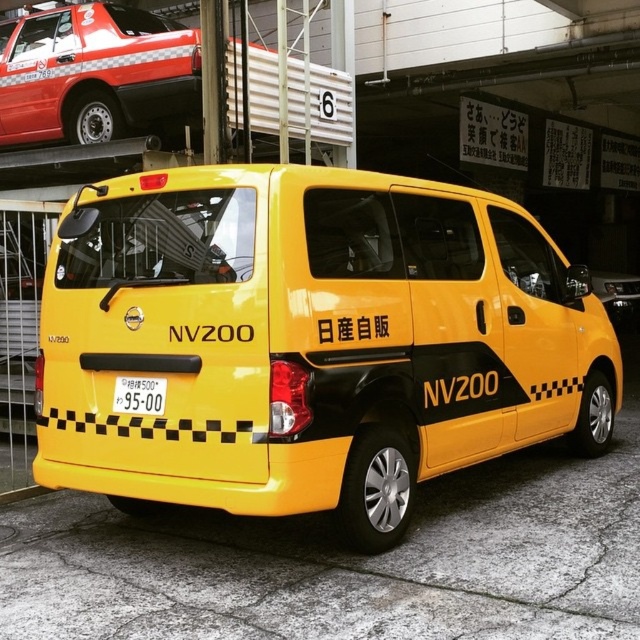
Who is more distant from viewer, (524,358) or (147,392)?

Positioned behind is point (524,358).

Does yellow matte van at center appear under yellow matte license plate at center?

Incorrect, yellow matte van at center is not positioned below yellow matte license plate at center.

What are the coordinates of `yellow matte van at center` in the screenshot? It's located at (308, 340).

Where is `yellow matte van at center`? Image resolution: width=640 pixels, height=640 pixels. yellow matte van at center is located at coordinates (308, 340).

Can you confirm if yellow matte van at center is wider than matte black taxi at upper left?

Correct, the width of yellow matte van at center exceeds that of matte black taxi at upper left.

Is yellow matte van at center above matte black taxi at upper left?

Actually, yellow matte van at center is below matte black taxi at upper left.

Where is `yellow matte van at center`? Image resolution: width=640 pixels, height=640 pixels. yellow matte van at center is located at coordinates (308, 340).

Which is more to the right, matte black taxi at upper left or yellow matte license plate at center?

From the viewer's perspective, yellow matte license plate at center appears more on the right side.

Based on the photo, can you confirm if matte black taxi at upper left is wider than yellow matte license plate at center?

Correct, the width of matte black taxi at upper left exceeds that of yellow matte license plate at center.

The width and height of the screenshot is (640, 640). Describe the element at coordinates (92, 72) in the screenshot. I see `matte black taxi at upper left` at that location.

Image resolution: width=640 pixels, height=640 pixels. Find the location of `matte black taxi at upper left`. matte black taxi at upper left is located at coordinates (92, 72).